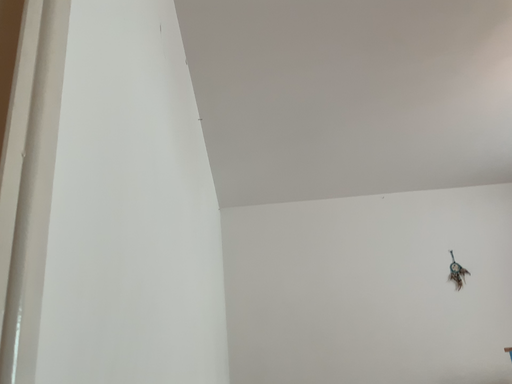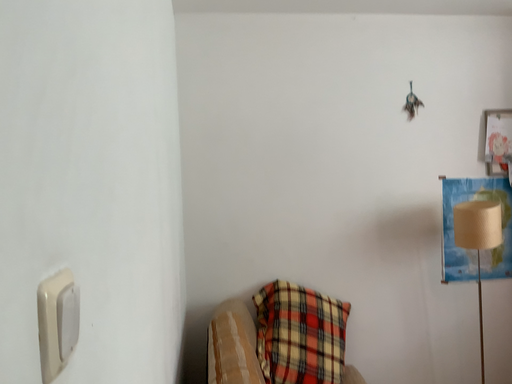
Question: How did the camera likely rotate when shooting the video?

Choices:
 (A) rotated upward
 (B) rotated downward

Answer: (B)